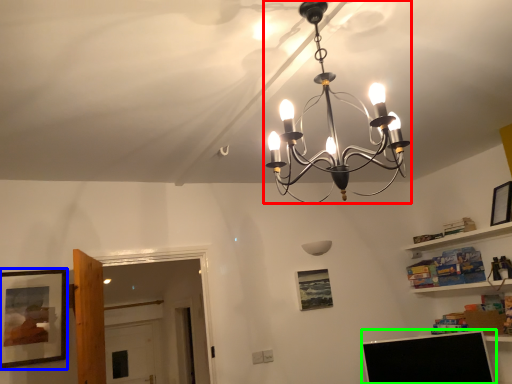
Question: Based on their relative distances, which object is farther from lamp (highlighted by a red box)? Choose from picture frame (highlighted by a blue box) and computer monitor (highlighted by a green box).

Choices:
 (A) picture frame
 (B) computer monitor

Answer: (B)